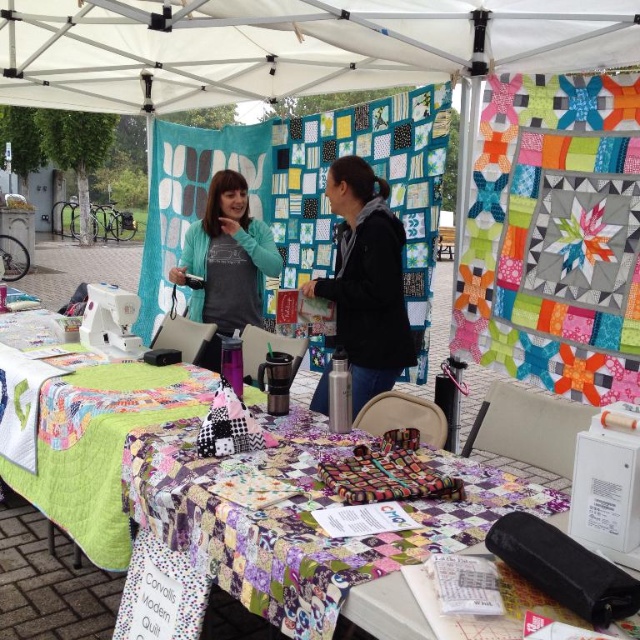
Who is positioned more to the left, white fabric canopy at upper center or matte teal sweater at center?

From the viewer's perspective, white fabric canopy at upper center appears more on the left side.

The image size is (640, 640). What do you see at coordinates (289, 45) in the screenshot?
I see `white fabric canopy at upper center` at bounding box center [289, 45].

Does point (228, 74) come behind point (237, 253)?

That is True.

Find the location of a particular element. white fabric canopy at upper center is located at coordinates (289, 45).

Is white fabric canopy at upper center to the left of black fleece jacket at center from the viewer's perspective?

Correct, you'll find white fabric canopy at upper center to the left of black fleece jacket at center.

Does white fabric canopy at upper center come in front of black fleece jacket at center?

No.

Is point (417, 80) closer to camera compared to point (316, 403)?

No.

Image resolution: width=640 pixels, height=640 pixels. In order to click on white fabric canopy at upper center in this screenshot , I will do `click(289, 45)`.

Does white fabric canopy at upper center appear under white plastic sewing machine at lower left?

Actually, white fabric canopy at upper center is above white plastic sewing machine at lower left.

Can you confirm if white fabric canopy at upper center is smaller than white plastic sewing machine at lower left?

No.

Between point (81, 96) and point (90, 333), which one is positioned in front?

Point (90, 333)

Image resolution: width=640 pixels, height=640 pixels. Identify the location of white fabric canopy at upper center. (289, 45).